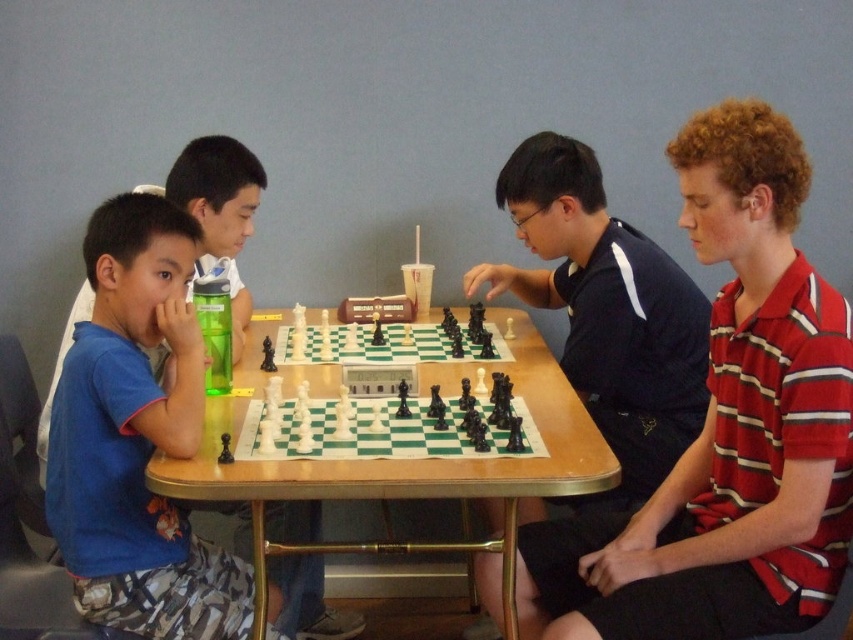
Looking at this image, is black glossy chess piece at center above blue fabric shirt at left?

Actually, black glossy chess piece at center is below blue fabric shirt at left.

Between point (537, 141) and point (91, 300), which one is positioned behind?

The point (537, 141) is behind.

Is point (543, 250) farther from camera compared to point (41, 444)?

Yes, it is behind point (41, 444).

Image resolution: width=853 pixels, height=640 pixels. I want to click on black glossy chess piece at center, so click(606, 312).

Is point (259, 621) farther from viewer compared to point (282, 337)?

No.

Based on the photo, does wooden at center have a larger size compared to white plastic chess set at center?

Yes.

The height and width of the screenshot is (640, 853). I want to click on wooden at center, so click(x=407, y=465).

Looking at this image, who is positioned more to the right, black glossy chess piece at center or wooden at center?

black glossy chess piece at center

Is point (641, 444) farther from viewer compared to point (155, 452)?

That is True.

At what (x,y) coordinates should I click in order to perform the action: click on black glossy chess piece at center. Please return your answer as a coordinate pair (x, y). The image size is (853, 640). Looking at the image, I should click on (606, 312).